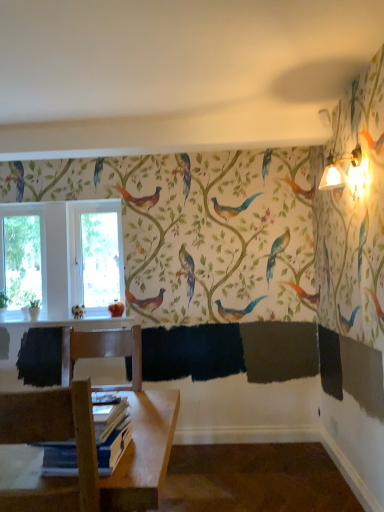
Where is `free space to the left of matte white bird at lower left`? free space to the left of matte white bird at lower left is located at coordinates (58, 321).